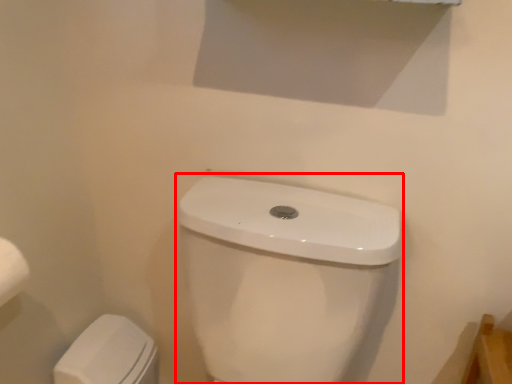
Question: From the image's perspective, what is the correct spatial relationship of sink (annotated by the red box) in relation to porcelain?

Choices:
 (A) above
 (B) below

Answer: (A)